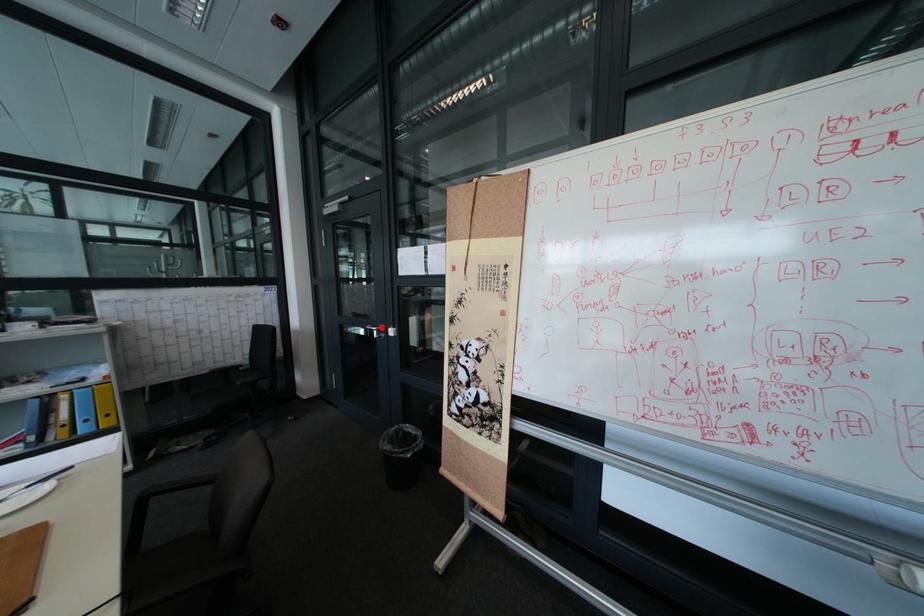
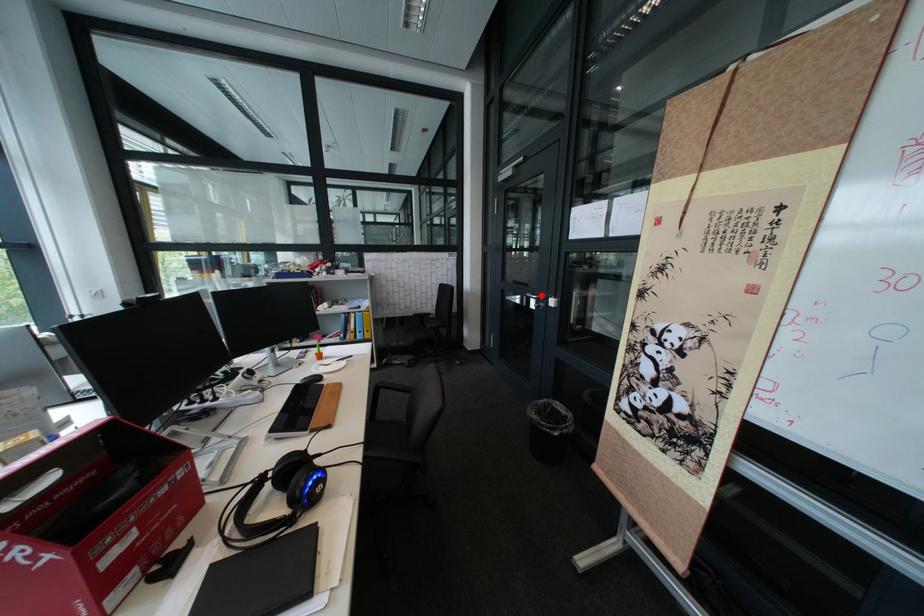
In the scene shown: I am providing you with two images of the same scene from different viewpoints. A red point is marked on the first image and another point is marked on the second image. Are the points marked in image1 and image2 representing the same 3D position?

Yes